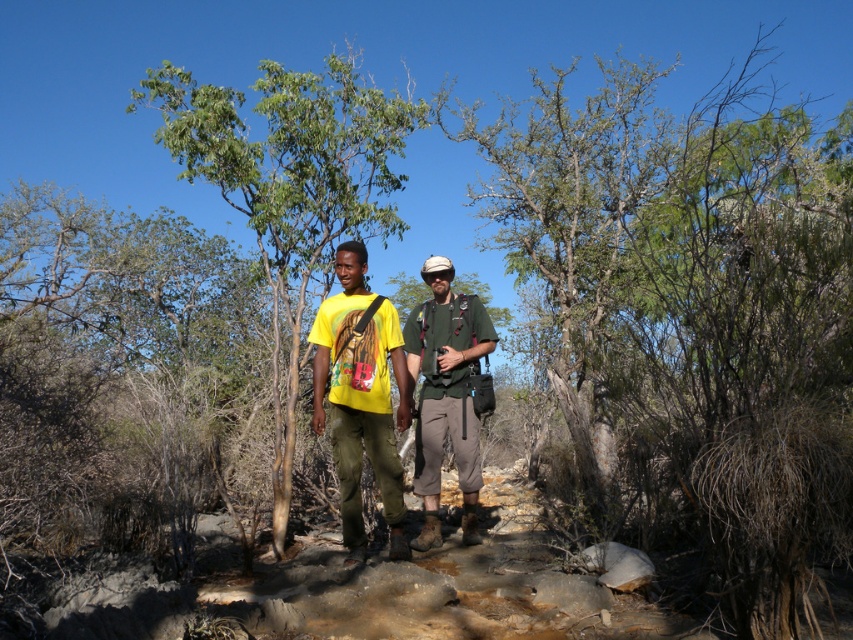
Question: Which object is the farthest from the yellow matte t-shirt at center?

Choices:
 (A) green fabric shirt at center
 (B) green leafy tree at center

Answer: (B)

Question: Which of the following is the closest to the observer?

Choices:
 (A) (445, 362)
 (B) (291, 488)
 (C) (347, 540)

Answer: (C)

Question: Does yellow matte t-shirt at center have a greater width compared to green fabric shirt at center?

Choices:
 (A) no
 (B) yes

Answer: (B)

Question: In this image, where is yellow matte t-shirt at center located relative to green fabric shirt at center?

Choices:
 (A) below
 (B) above

Answer: (B)

Question: Is green leafy tree at center to the left of yellow matte t-shirt at center from the viewer's perspective?

Choices:
 (A) yes
 (B) no

Answer: (A)

Question: Which object appears farthest from the camera in this image?

Choices:
 (A) green leafy tree at center
 (B) yellow matte t-shirt at center

Answer: (A)